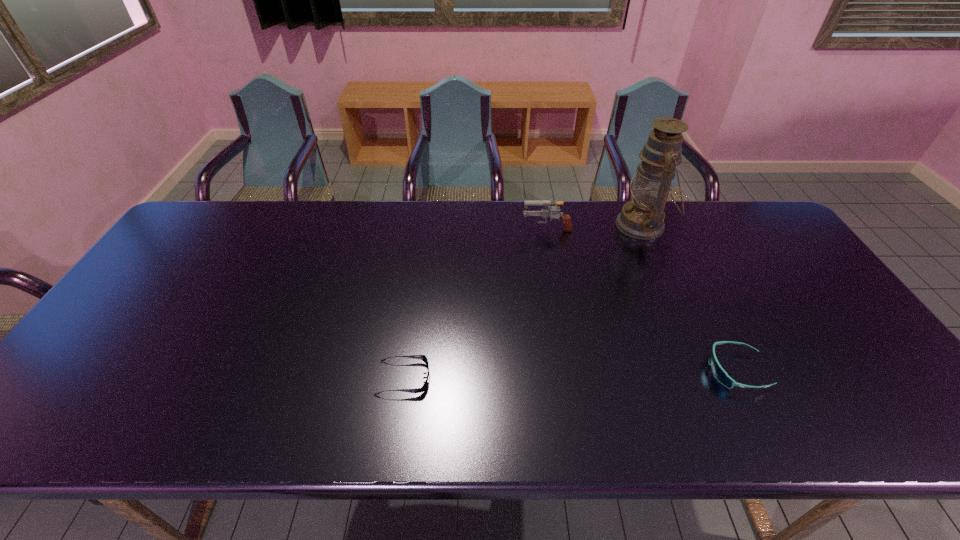
This screenshot has width=960, height=540. I want to click on vacant region located at the barrel end of the second tallest object, so click(492, 228).

What are the coordinates of `free location located 0.240m on the front-facing side of the right sunglasses` in the screenshot? It's located at (607, 370).

Where is `free space located on the front-facing side of the right sunglasses`? This screenshot has height=540, width=960. free space located on the front-facing side of the right sunglasses is located at coordinates (607, 370).

The width and height of the screenshot is (960, 540). In order to click on vacant space situated 0.280m on the front-facing side of the right sunglasses in this screenshot , I will do `click(590, 370)`.

At what (x,y) coordinates should I click in order to perform the action: click on free space located 0.160m on the front-facing side of the shorter sunglasses. Please return your answer as a coordinate pair (x, y). Looking at the image, I should click on (497, 378).

Find the location of a particular element. oil lamp at the far edge is located at coordinates (643, 218).

Locate an element on the screen. This screenshot has height=540, width=960. gun at the far edge is located at coordinates (545, 213).

Where is `vacant space at the far edge of the desktop`? Image resolution: width=960 pixels, height=540 pixels. vacant space at the far edge of the desktop is located at coordinates (320, 213).

In the image, there is a desktop. At what (x,y) coordinates should I click in order to perform the action: click on vacant space at the near edge. Please return your answer as a coordinate pair (x, y). The image size is (960, 540). Looking at the image, I should click on (681, 441).

This screenshot has height=540, width=960. I want to click on free point at the right edge, so click(801, 291).